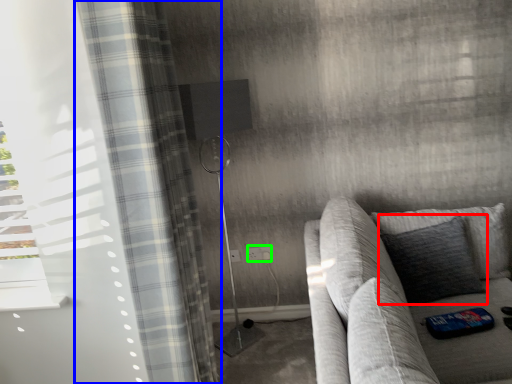
Question: Which object is positioned farthest from pillow (highlighted by a red box)? Select from curtain (highlighted by a blue box) and electric outlet (highlighted by a green box).

Choices:
 (A) curtain
 (B) electric outlet

Answer: (A)